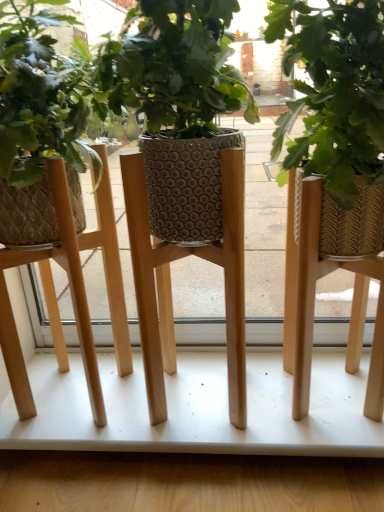
Question: Is wooden table at center facing away from woven straw planter at center?

Choices:
 (A) no
 (B) yes

Answer: (A)

Question: Does wooden table at center have a larger size compared to woven straw planter at center?

Choices:
 (A) yes
 (B) no

Answer: (A)

Question: Can you see wooden table at center touching woven straw planter at center?

Choices:
 (A) yes
 (B) no

Answer: (B)

Question: Considering the relative sizes of wooden table at center and woven straw planter at center in the image provided, is wooden table at center thinner than woven straw planter at center?

Choices:
 (A) yes
 (B) no

Answer: (B)

Question: Can you confirm if wooden table at center is positioned to the left of woven straw planter at center?

Choices:
 (A) no
 (B) yes

Answer: (B)

Question: From a real-world perspective, relative to woven straw planter at center, is wooden table at center vertically above or below?

Choices:
 (A) below
 (B) above

Answer: (A)

Question: Is point (279, 378) closer or farther from the camera than point (349, 17)?

Choices:
 (A) farther
 (B) closer

Answer: (A)

Question: Is wooden table at center wider or thinner than woven straw planter at center?

Choices:
 (A) thin
 (B) wide

Answer: (B)

Question: Looking at the image, does wooden table at center seem bigger or smaller compared to woven straw planter at center?

Choices:
 (A) small
 (B) big

Answer: (B)

Question: Considering the positions of wooden stool at center and woven straw planter at center in the image, is wooden stool at center bigger or smaller than woven straw planter at center?

Choices:
 (A) big
 (B) small

Answer: (B)

Question: Considering the positions of wooden stool at center and woven straw planter at center in the image, is wooden stool at center wider or thinner than woven straw planter at center?

Choices:
 (A) thin
 (B) wide

Answer: (B)

Question: In the image, is wooden stool at center positioned in front of or behind woven straw planter at center?

Choices:
 (A) front
 (B) behind

Answer: (B)

Question: Is wooden stool at center inside or outside of woven straw planter at center?

Choices:
 (A) inside
 (B) outside

Answer: (B)

Question: Is wooden table at center bigger or smaller than wooden stool at center?

Choices:
 (A) big
 (B) small

Answer: (A)

Question: Is wooden table at center in front of or behind wooden stool at center in the image?

Choices:
 (A) front
 (B) behind

Answer: (B)